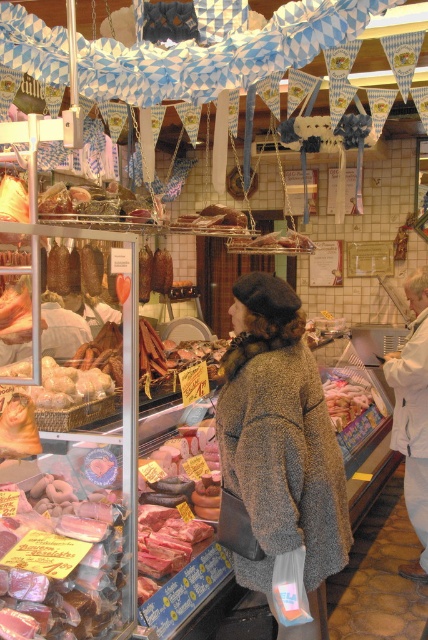
Does fuzzy brown coat at center appear on the left side of pink glossy meat at lower left?

In fact, fuzzy brown coat at center is to the right of pink glossy meat at lower left.

Is fuzzy brown coat at center closer to the viewer compared to pink glossy meat at lower left?

No, fuzzy brown coat at center is behind pink glossy meat at lower left.

What do you see at coordinates (278, 451) in the screenshot? The height and width of the screenshot is (640, 428). I see `fuzzy brown coat at center` at bounding box center [278, 451].

The width and height of the screenshot is (428, 640). What are the coordinates of `fuzzy brown coat at center` in the screenshot? It's located at (278, 451).

From the picture: Who is positioned more to the right, fuzzy brown coat at center or smooth pink sausage at center?

smooth pink sausage at center

Between point (302, 403) and point (323, 381), which one is positioned behind?

The point (323, 381) is more distant.

Locate an element on the screen. The width and height of the screenshot is (428, 640). fuzzy brown coat at center is located at coordinates (278, 451).

Who is positioned more to the left, pink glossy meat at lower left or smooth pink sausage at center?

pink glossy meat at lower left

Is pink glossy meat at lower left closer to the viewer compared to smooth pink sausage at center?

Yes, it is in front of smooth pink sausage at center.

Is point (82, 582) in front of point (321, 372)?

Yes, it is.

The width and height of the screenshot is (428, 640). What are the coordinates of `pink glossy meat at lower left` in the screenshot? It's located at (62, 563).